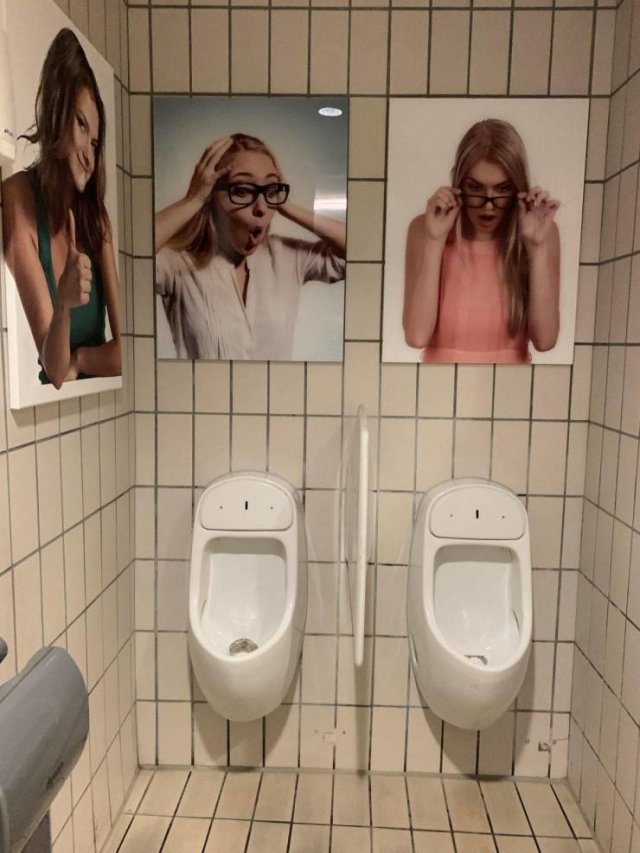
Locate an element on the screen. The image size is (640, 853). toilet paper holder is located at coordinates (26, 739).